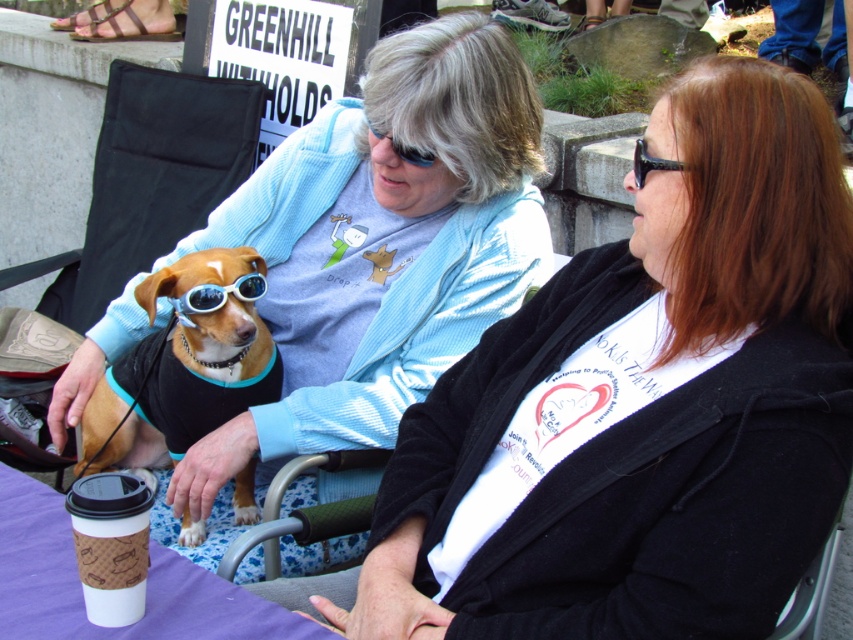
Between matte blue cardigan at center and blue reflective sunglasses at center, which one has more height?

matte blue cardigan at center is taller.

Can you confirm if matte blue cardigan at center is positioned below blue reflective sunglasses at center?

Correct, matte blue cardigan at center is located below blue reflective sunglasses at center.

Does point (622, 444) lie in front of point (379, 138)?

Yes, point (622, 444) is closer to viewer.

The image size is (853, 640). Identify the location of matte blue cardigan at center. (653, 401).

Who is positioned more to the right, matte blue cardigan at center or light blue corduroy sweater at center?

From the viewer's perspective, matte blue cardigan at center appears more on the right side.

Between point (753, 237) and point (483, 284), which one is positioned in front?

Point (753, 237)

Does point (602, 480) lie in front of point (416, 138)?

Yes, it is.

The height and width of the screenshot is (640, 853). In order to click on matte blue cardigan at center in this screenshot , I will do `click(653, 401)`.

Does brownsmooth fabricdog at center-left have a lesser width compared to black plastic sunglasses at upper right?

Incorrect, brownsmooth fabricdog at center-left's width is not less than black plastic sunglasses at upper right's.

Can you confirm if brownsmooth fabricdog at center-left is shorter than black plastic sunglasses at upper right?

No.

Is point (207, 310) positioned after point (640, 163)?

Yes, it is behind point (640, 163).

Identify the location of brownsmooth fabricdog at center-left. The height and width of the screenshot is (640, 853). (184, 364).